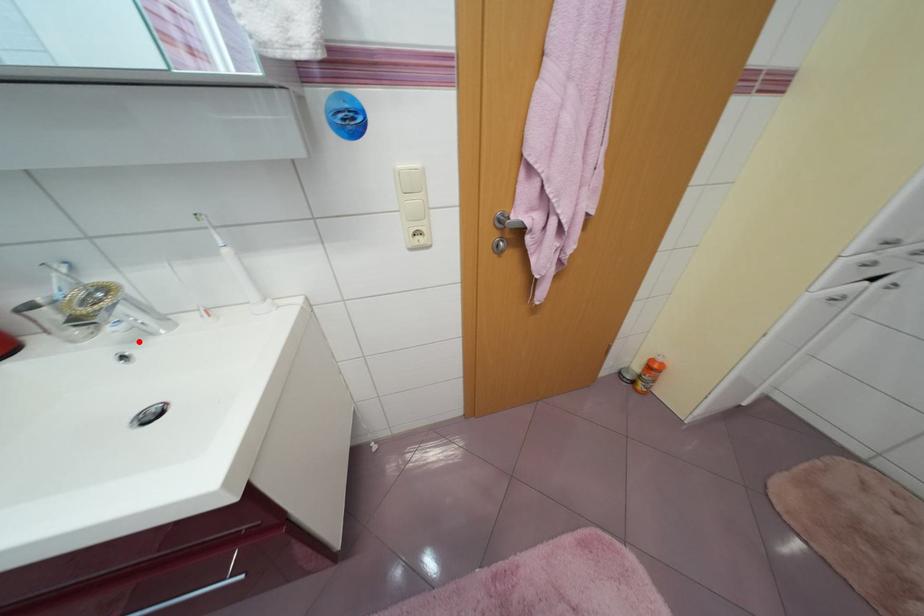
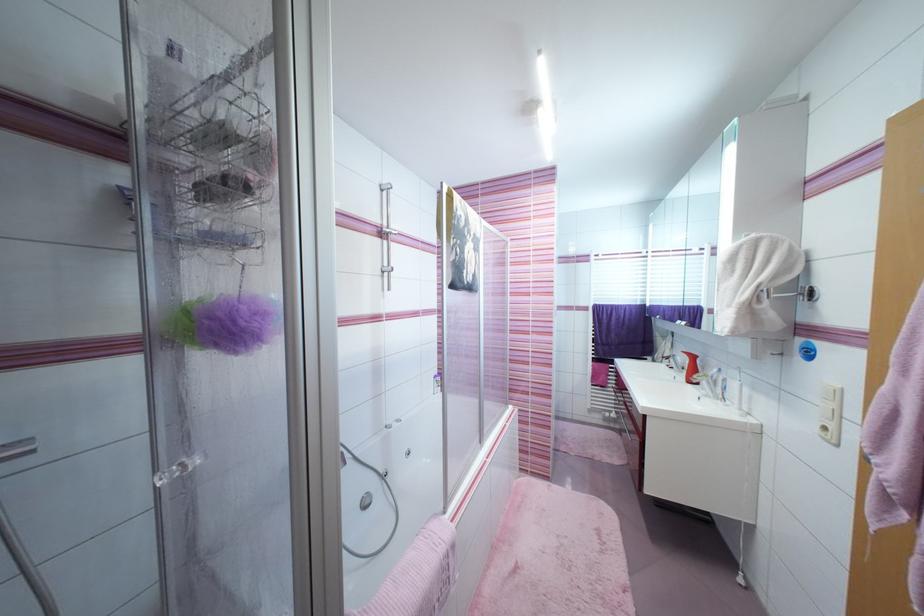
In the second image, find the point that corresponds to the highlighted location in the first image.

(711, 398)